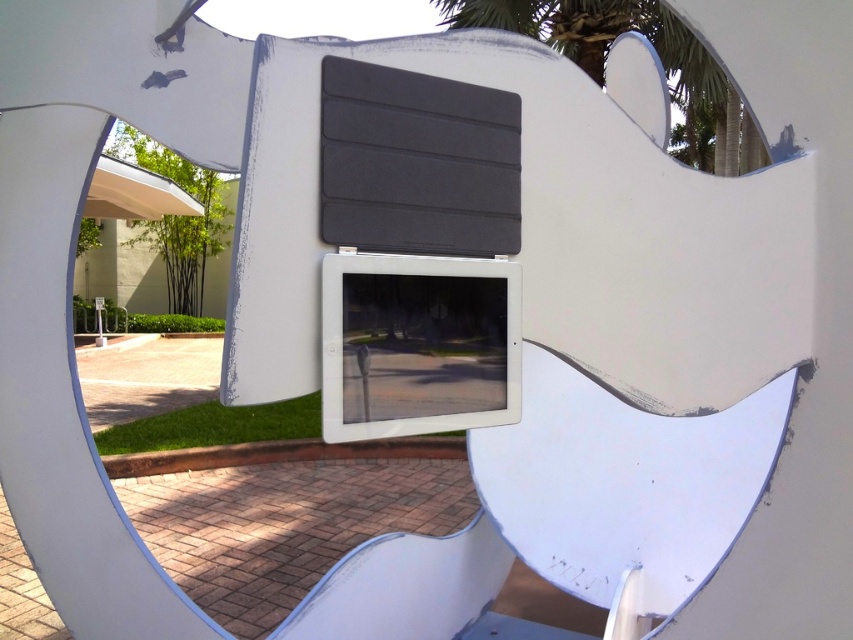
Between green leafy palm tree at upper right and green leafy palm tree at upper left, which one is positioned higher?

green leafy palm tree at upper left is above.

Can you confirm if green leafy palm tree at upper right is positioned to the right of green leafy palm tree at upper left?

Indeed, green leafy palm tree at upper right is positioned on the right side of green leafy palm tree at upper left.

Where is `green leafy palm tree at upper right`? The height and width of the screenshot is (640, 853). green leafy palm tree at upper right is located at coordinates (659, 56).

This screenshot has width=853, height=640. I want to click on green leafy palm tree at upper right, so click(659, 56).